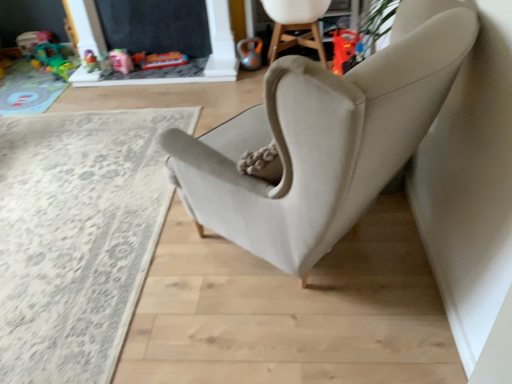
Find the location of `vacant area that lies in front of translucent plastic toy at upper left, which is the fourth toy from right to left`. vacant area that lies in front of translucent plastic toy at upper left, which is the fourth toy from right to left is located at coordinates (29, 73).